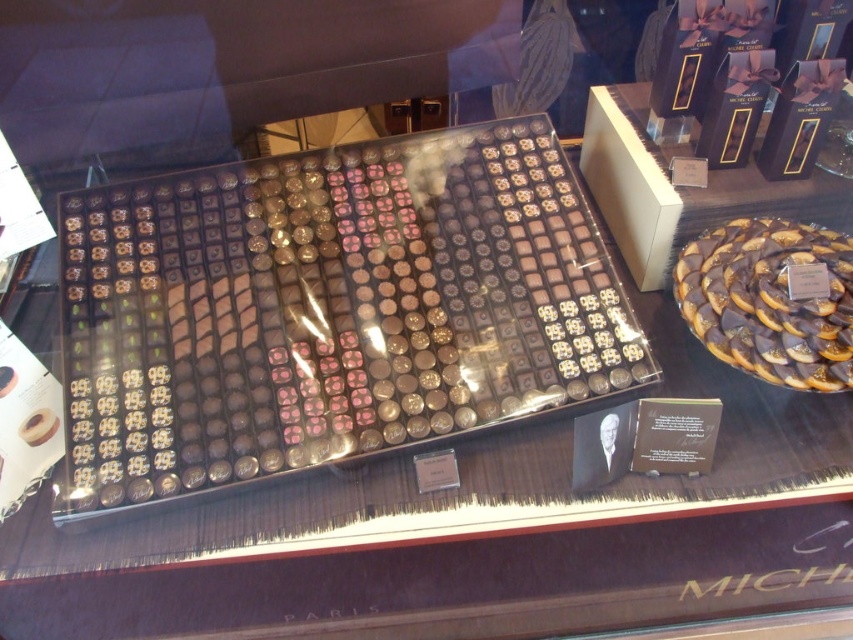
Is shiny gold chocolate at center further to the viewer compared to chocolate-coated cookie at center-right?

No, shiny gold chocolate at center is in front of chocolate-coated cookie at center-right.

Based on the photo, is shiny gold chocolate at center above chocolate-coated cookie at center-right?

Correct, shiny gold chocolate at center is located above chocolate-coated cookie at center-right.

In order to click on shiny gold chocolate at center in this screenshot , I will do `click(329, 310)`.